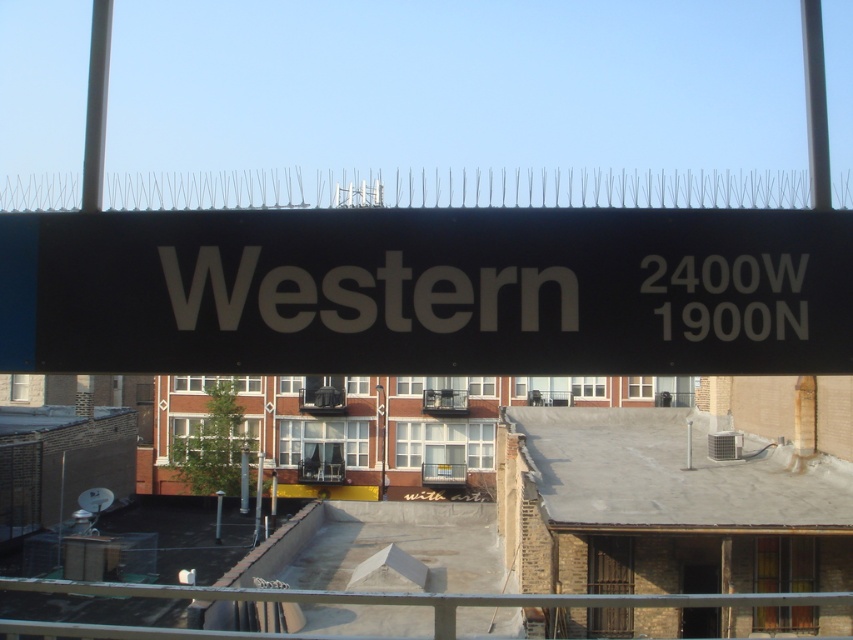
Question: Is black matte sign at upper center further to the viewer compared to metallic pole at upper left?

Choices:
 (A) no
 (B) yes

Answer: (A)

Question: Is black matte sign at upper center below smooth gray pole at upper right?

Choices:
 (A) yes
 (B) no

Answer: (A)

Question: Can you confirm if black matte sign at upper center is positioned below metallic pole at upper left?

Choices:
 (A) yes
 (B) no

Answer: (A)

Question: Which is nearer to the black matte sign at upper center?

Choices:
 (A) metallic gray rail at lower center
 (B) metallic pole at upper left

Answer: (B)

Question: Which point appears closest to the camera in this image?

Choices:
 (A) (811, 157)
 (B) (103, 33)
 (C) (451, 604)
 (D) (502, 237)

Answer: (D)

Question: Which of the following is the farthest from the observer?

Choices:
 (A) black matte sign at upper center
 (B) smooth gray pole at upper right

Answer: (B)